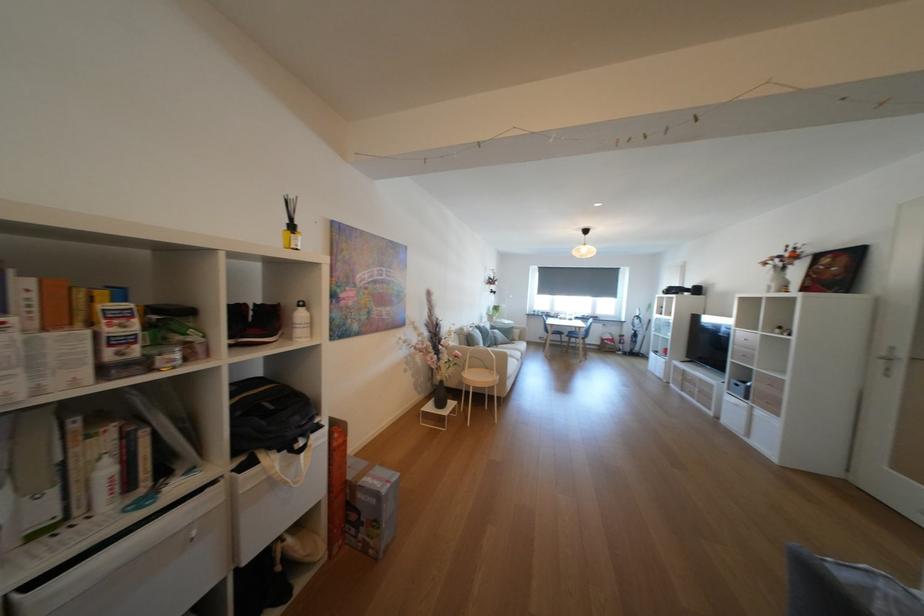
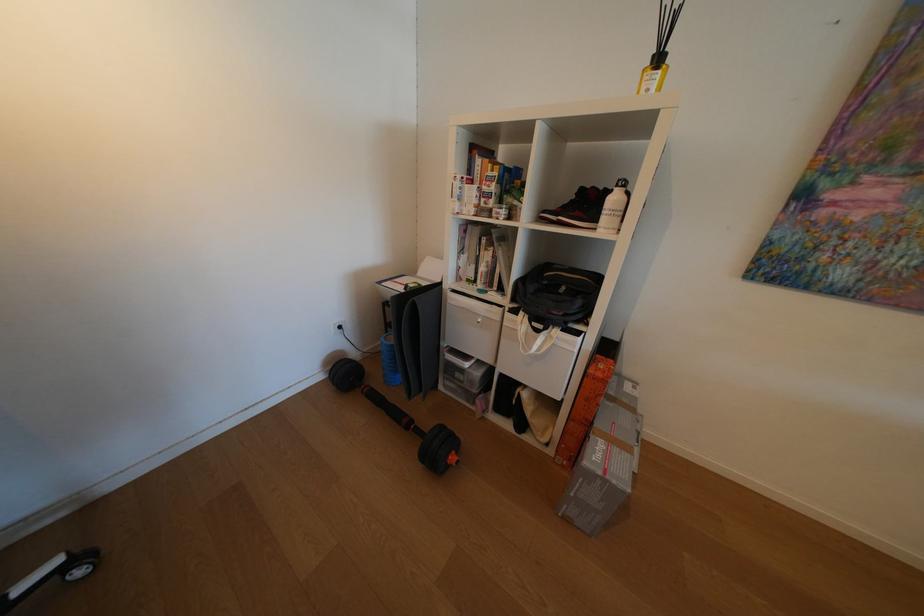
Find the pixel in the second image that matches the point at 406,480 in the first image.

(626, 483)